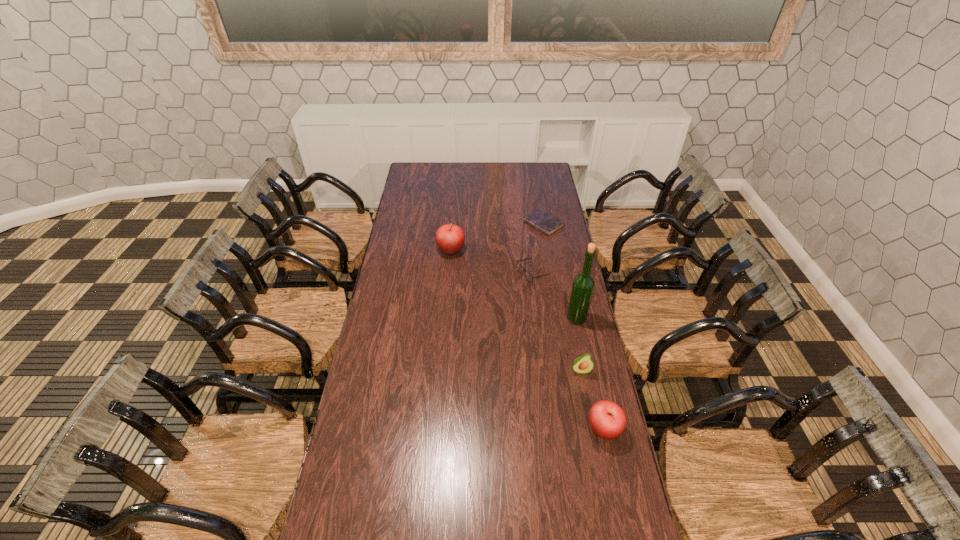
Find the location of a particular element. This screenshot has height=540, width=960. avocado is located at coordinates (583, 364).

Identify the location of vacant space located on the front of the taller apple. This screenshot has width=960, height=540. (448, 287).

Locate an element on the screen. Image resolution: width=960 pixels, height=540 pixels. free space located on the back of the right apple is located at coordinates (586, 348).

Locate an element on the screen. Image resolution: width=960 pixels, height=540 pixels. vacant space located with the lenses facing outward on the second shortest object is located at coordinates (499, 273).

This screenshot has height=540, width=960. Identify the location of vacant space located with the lenses facing outward on the second shortest object. (468, 273).

Where is `free point located 0.090m with the lenses facing outward on the second shortest object`? The image size is (960, 540). free point located 0.090m with the lenses facing outward on the second shortest object is located at coordinates (x=497, y=273).

Find the location of `vacant area located 0.160m on the left of the tallest object`. vacant area located 0.160m on the left of the tallest object is located at coordinates (528, 318).

The height and width of the screenshot is (540, 960). Find the location of `vacant space located 0.200m on the left of the diary`. vacant space located 0.200m on the left of the diary is located at coordinates (486, 225).

Where is `free spot located on the cut side of the fifth farthest object`? This screenshot has width=960, height=540. free spot located on the cut side of the fifth farthest object is located at coordinates (596, 449).

I want to click on apple that is at the right edge, so click(x=607, y=419).